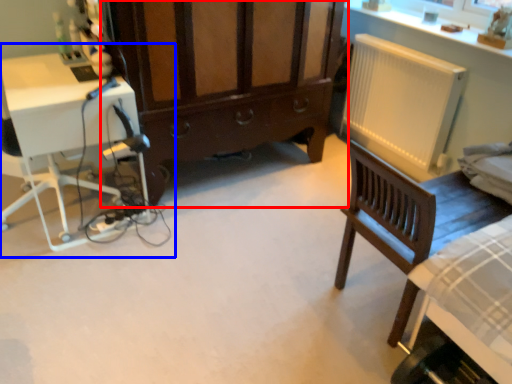
Question: Which object appears farthest to the camera in this image, cabinetry (highlighted by a red box) or computer desk (highlighted by a blue box)?

Choices:
 (A) cabinetry
 (B) computer desk

Answer: (A)